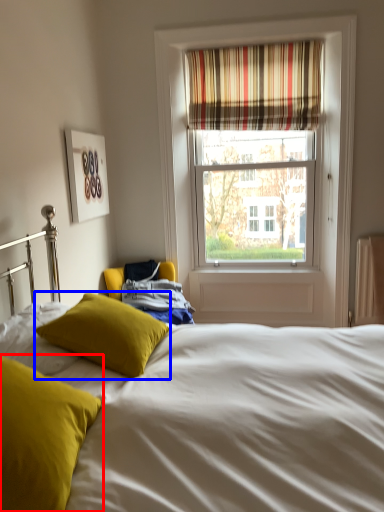
Question: Which of the following is the farthest to the observer, pillow (highlighted by a red box) or pillow (highlighted by a blue box)?

Choices:
 (A) pillow
 (B) pillow

Answer: (B)